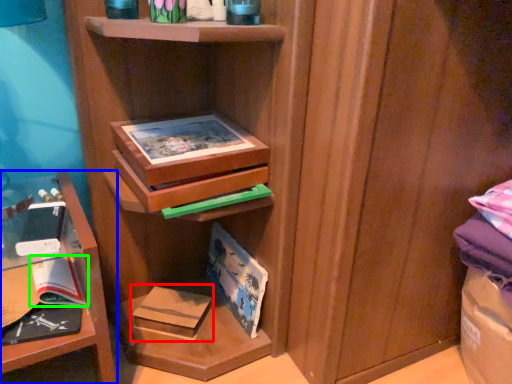
Question: Considering the real-world distances, which object is farthest from paperback book (highlighted by a red box)? shelf (highlighted by a blue box) or paperback book (highlighted by a green box)?

Choices:
 (A) shelf
 (B) paperback book

Answer: (A)